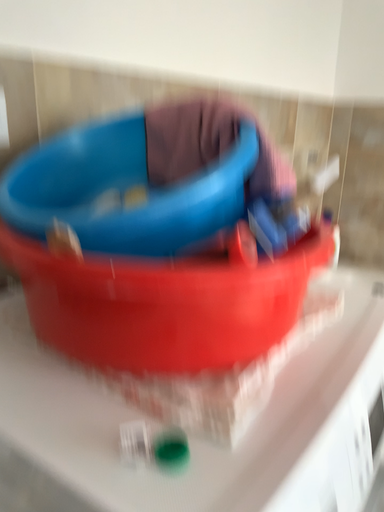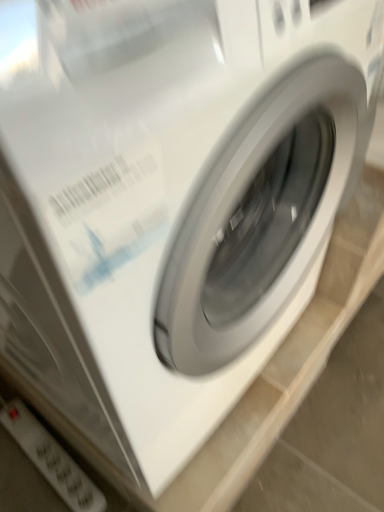
Question: How did the camera likely rotate when shooting the video?

Choices:
 (A) rotated downward
 (B) rotated upward

Answer: (A)